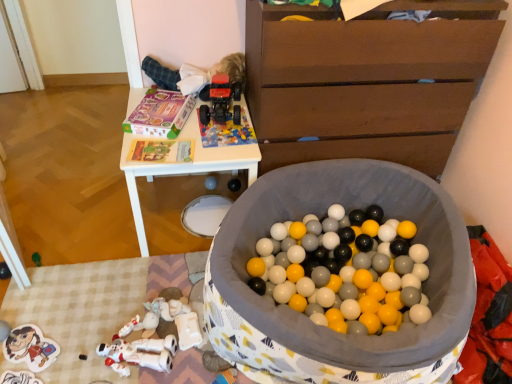
Question: Is matte black speaker at center, the second toy in the right-to-left sequence, wider than brown wooden chest of drawers at upper right?

Choices:
 (A) no
 (B) yes

Answer: (A)

Question: Is matte black speaker at center, the second toy in the right-to-left sequence, further to camera compared to brown wooden chest of drawers at upper right?

Choices:
 (A) no
 (B) yes

Answer: (B)

Question: From the image's perspective, would you say matte black speaker at center, the second toy in the right-to-left sequence, is shown under brown wooden chest of drawers at upper right?

Choices:
 (A) yes
 (B) no

Answer: (A)

Question: From a real-world perspective, is matte black speaker at center, the second toy in the right-to-left sequence, on brown wooden chest of drawers at upper right?

Choices:
 (A) no
 (B) yes

Answer: (A)

Question: From a real-world perspective, is matte black speaker at center, acting as the 5th toy starting from the left, positioned under brown wooden chest of drawers at upper right based on gravity?

Choices:
 (A) yes
 (B) no

Answer: (A)

Question: Visually, is brown wooden chest of drawers at upper right positioned to the left or to the right of fluffy white baby at upper center?

Choices:
 (A) left
 (B) right

Answer: (B)

Question: From a real-world perspective, is brown wooden chest of drawers at upper right above or below fluffy white baby at upper center?

Choices:
 (A) below
 (B) above

Answer: (A)

Question: Is brown wooden chest of drawers at upper right spatially inside fluffy white baby at upper center, or outside of it?

Choices:
 (A) inside
 (B) outside

Answer: (B)

Question: From the image's perspective, is brown wooden chest of drawers at upper right located above or below fluffy white baby at upper center?

Choices:
 (A) above
 (B) below

Answer: (B)

Question: Relative to matte black speaker at center, the second toy in the right-to-left sequence, is matte plastic sticker at lower left, which ranks as the 6th toy in right-to-left order, in front or behind?

Choices:
 (A) behind
 (B) front

Answer: (B)

Question: Which is correct: matte plastic sticker at lower left, which ranks as the 6th toy in right-to-left order, is inside matte black speaker at center, acting as the 5th toy starting from the left, or outside of it?

Choices:
 (A) inside
 (B) outside

Answer: (B)

Question: From their relative heights in the image, would you say matte plastic sticker at lower left, which ranks as the 6th toy in right-to-left order, is taller or shorter than matte black speaker at center, acting as the 5th toy starting from the left?

Choices:
 (A) short
 (B) tall

Answer: (A)

Question: Looking at the image, does matte plastic sticker at lower left, which is counted as the 1th toy, starting from the left, seem bigger or smaller compared to matte black speaker at center, the second toy in the right-to-left sequence?

Choices:
 (A) small
 (B) big

Answer: (B)

Question: Does point (230, 187) appear closer or farther from the camera than point (51, 357)?

Choices:
 (A) farther
 (B) closer

Answer: (A)

Question: Is matte black speaker at center, acting as the 5th toy starting from the left, inside or outside of matte plastic sticker at lower left, which ranks as the 6th toy in right-to-left order?

Choices:
 (A) outside
 (B) inside

Answer: (A)